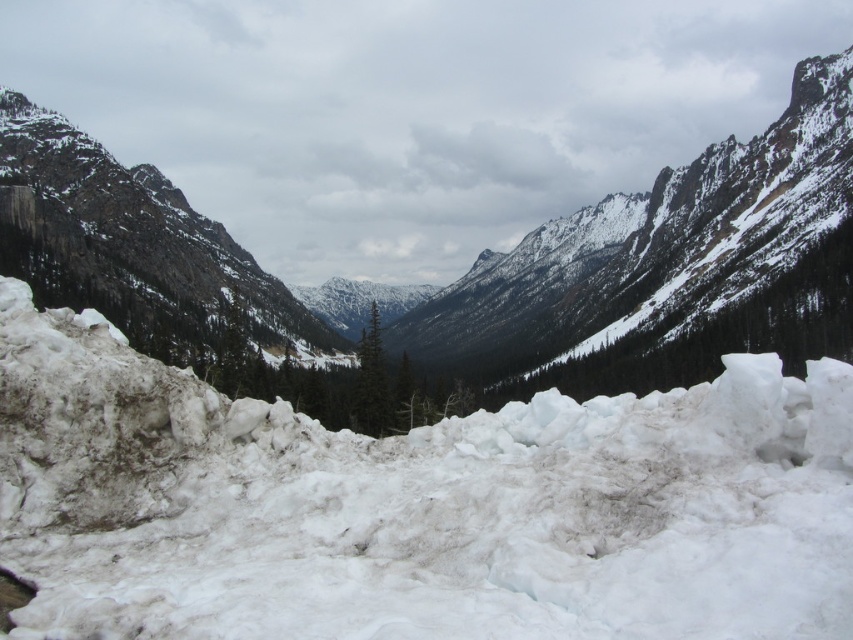
At what (x,y) coordinates should I click in order to perform the action: click on white frosty snow at center. Please return your answer as a coordinate pair (x, y). Looking at the image, I should click on [x=415, y=506].

Does white frosty snow at center appear on the right side of snowy rock at lower left?

In fact, white frosty snow at center is to the left of snowy rock at lower left.

Identify the location of white frosty snow at center. (415, 506).

At what (x,y) coordinates should I click in order to perform the action: click on white frosty snow at center. Please return your answer as a coordinate pair (x, y). The height and width of the screenshot is (640, 853). Looking at the image, I should click on (415, 506).